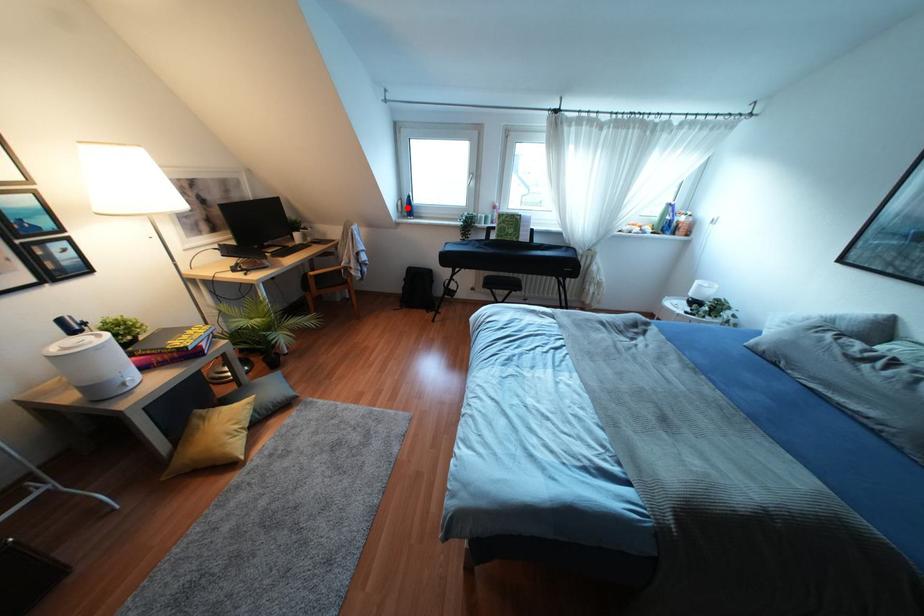
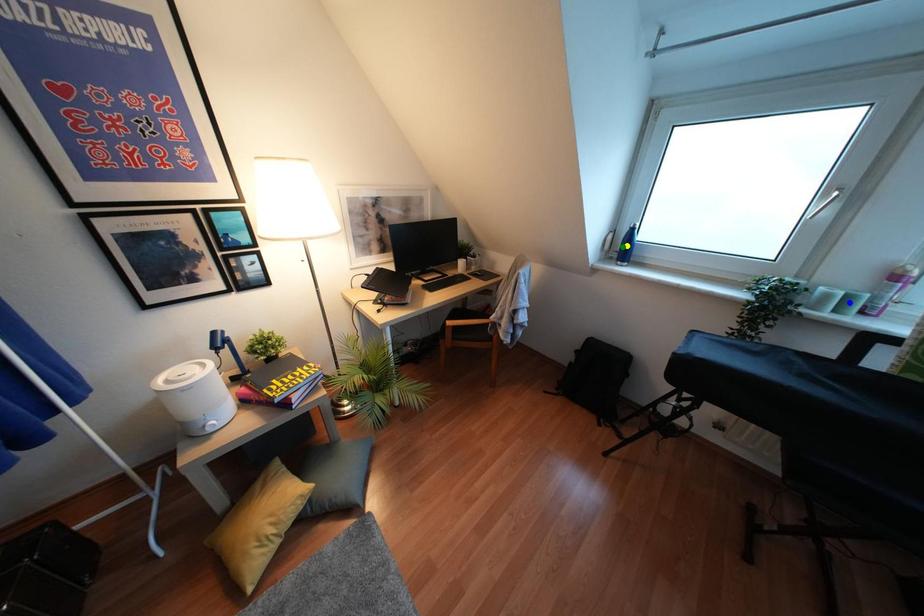
Question: I am providing you with two images of the same scene from different viewpoints. A red point is marked on the first image. You are given multiple points on the second image. Can you choose the point in image 2 that corresponds to the point in image 1?

Choices:
 (A) blue point
 (B) yellow point
 (C) green point

Answer: (C)